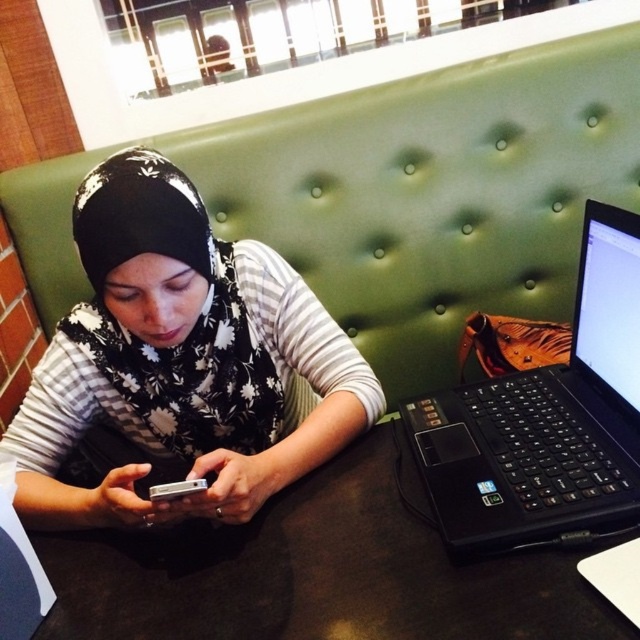
Image resolution: width=640 pixels, height=640 pixels. I want to click on black floral hijab at center, so click(x=182, y=360).

Which of these two, black floral hijab at center or black matte table at center, stands taller?

black floral hijab at center is taller.

In order to click on black floral hijab at center in this screenshot , I will do point(182,360).

Can you confirm if black matte table at center is smaller than silver metallic smartphone at center?

No.

The width and height of the screenshot is (640, 640). In order to click on black matte table at center in this screenshot , I will do `click(317, 573)`.

Is black matte laptop at right thinner than silver metallic smartphone at center?

No.

Is black matte laptop at right smaller than silver metallic smartphone at center?

No.

Who is more distant from viewer, [602,221] or [163,486]?

The point [602,221] is more distant.

Identify the location of black matte laptop at right. This screenshot has width=640, height=640. (547, 419).